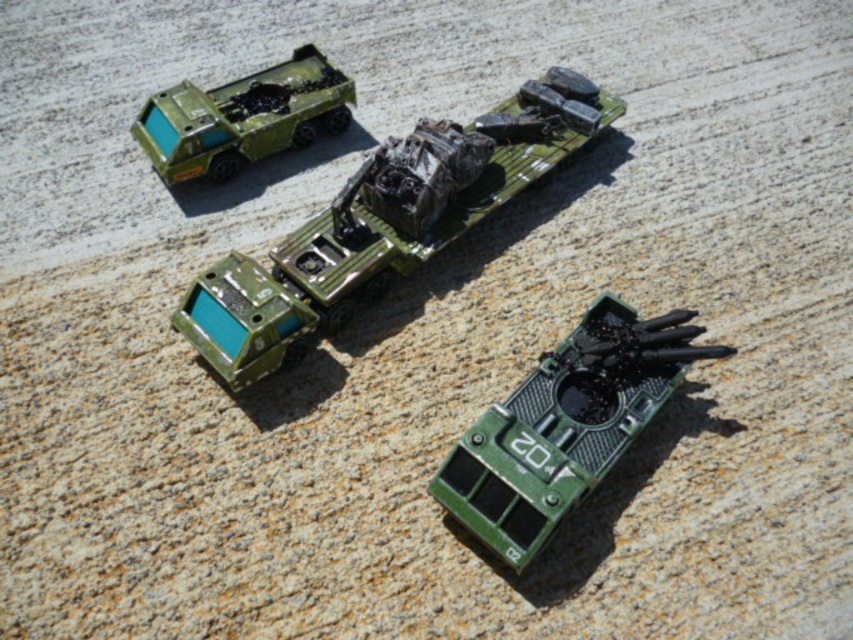
Does point (653, 372) come in front of point (209, 93)?

That is True.

Which is more to the left, green matte tank at lower right or matte green plastic truck at upper left?

matte green plastic truck at upper left

Who is more distant from viewer, (636,339) or (192,113)?

Point (192,113)

Find the location of a particular element. This screenshot has width=853, height=640. green matte tank at lower right is located at coordinates (566, 426).

Who is lower down, matte green truck at center or green matte tank at lower right?

green matte tank at lower right is lower down.

This screenshot has width=853, height=640. I want to click on matte green truck at center, so click(x=386, y=224).

Is matte green truck at center taller than matte green plastic truck at upper left?

Correct, matte green truck at center is much taller as matte green plastic truck at upper left.

Is matte green truck at center further to camera compared to matte green plastic truck at upper left?

That is False.

What do you see at coordinates (386, 224) in the screenshot?
I see `matte green truck at center` at bounding box center [386, 224].

Where is `matte green truck at center`? This screenshot has width=853, height=640. matte green truck at center is located at coordinates (386, 224).